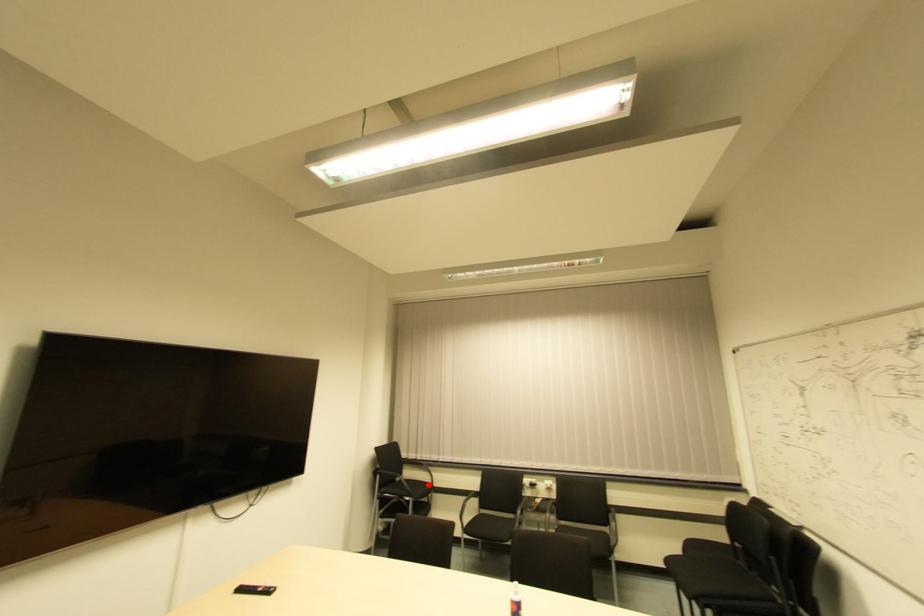
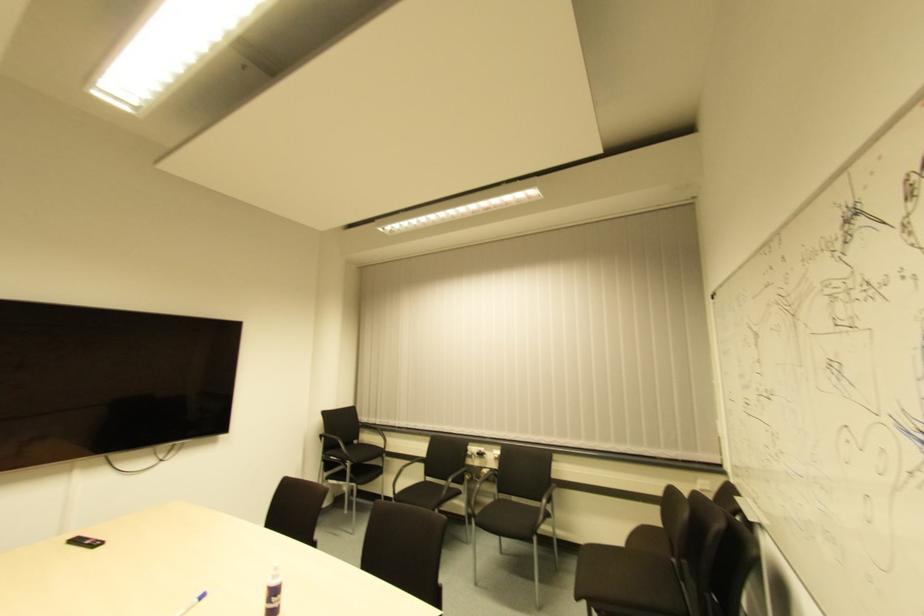
Locate, in the second image, the point that corresponds to the highlighted location in the first image.

(381, 448)